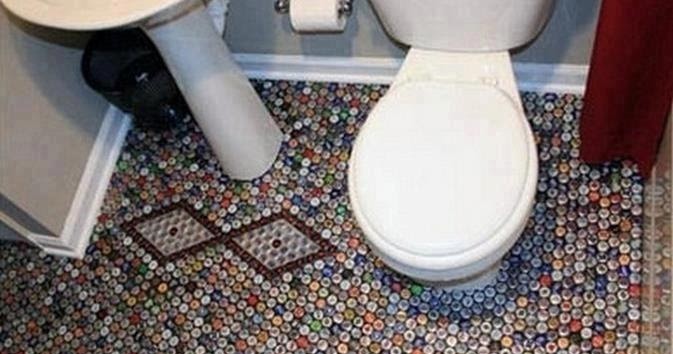
Find the location of a particular element. This screenshot has height=354, width=673. small black trashcan is located at coordinates (145, 102).